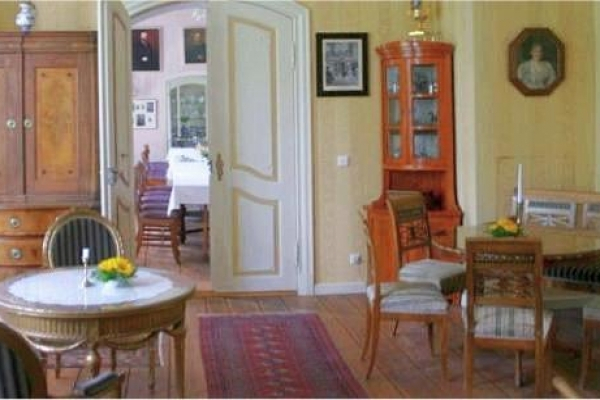
The image size is (600, 400). Identify the location of clock. (543, 84).